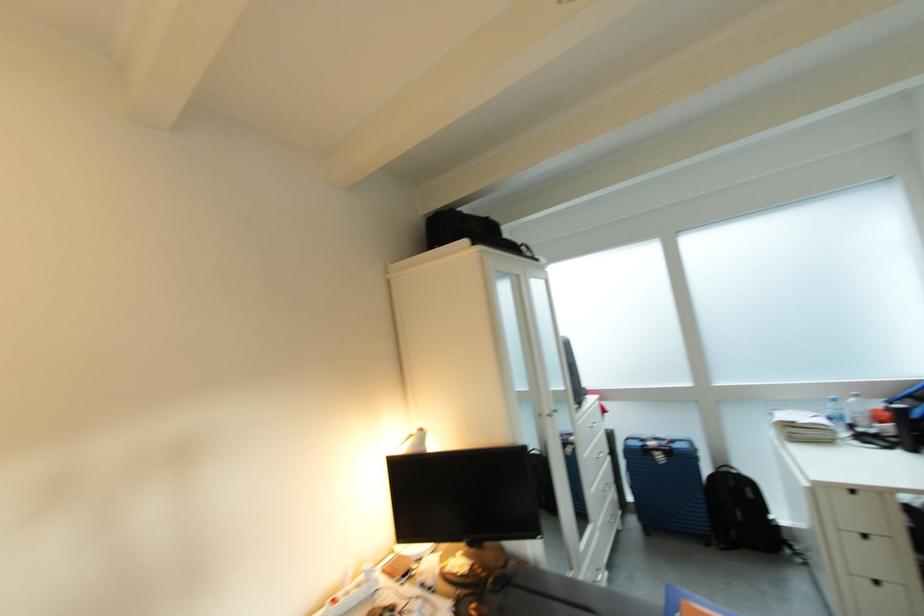
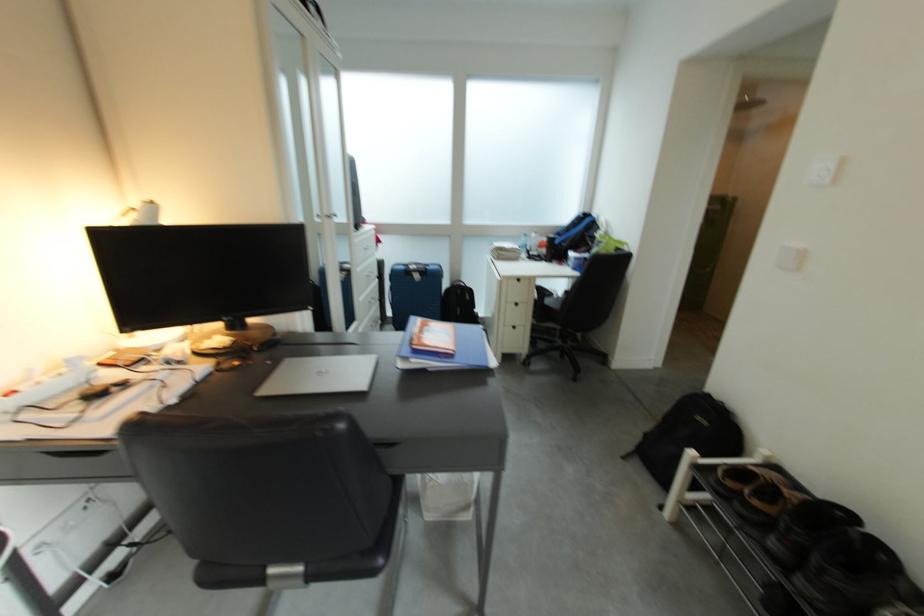
The images are taken continuously from a first-person perspective. In which direction is your viewpoint rotating?

The camera rotated toward right-down.